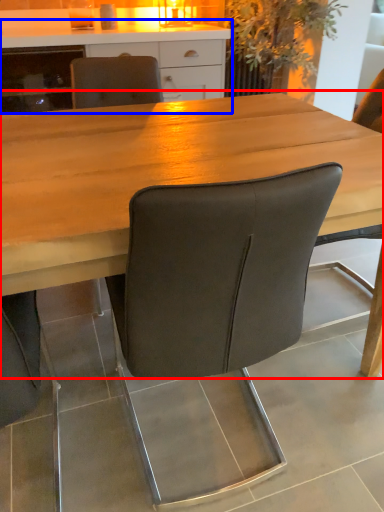
Question: Which object is further to the camera taking this photo, table (highlighted by a red box) or cabinetry (highlighted by a blue box)?

Choices:
 (A) table
 (B) cabinetry

Answer: (B)